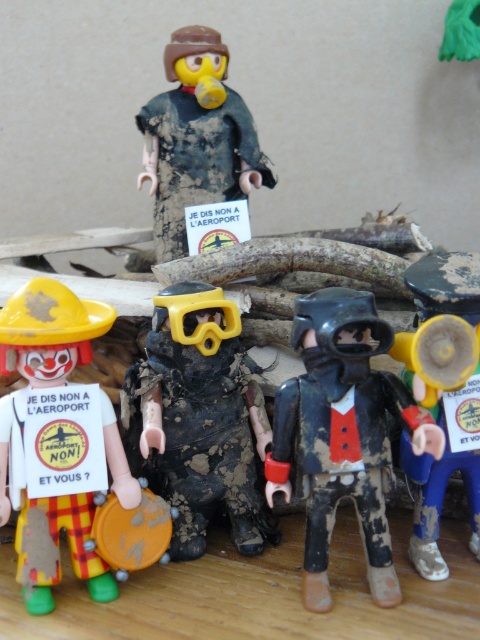
Question: Can you confirm if matte black figure at center is positioned to the left of dirty plastic figure at upper center?

Choices:
 (A) no
 (B) yes

Answer: (A)

Question: Can you confirm if matte yellow hat at left is positioned above yellow matte megaphone at right?

Choices:
 (A) no
 (B) yes

Answer: (A)

Question: Which of these objects is positioned farthest from the dirty plastic figure at upper center?

Choices:
 (A) matte black diving suit at center
 (B) matte yellow hat at left
 (C) matte black figure at center

Answer: (C)

Question: Which point appears farthest from the camera in this image?

Choices:
 (A) (160, 118)
 (B) (66, 362)

Answer: (A)

Question: Is matte yellow hat at left further to the viewer compared to yellow matte megaphone at right?

Choices:
 (A) yes
 (B) no

Answer: (B)

Question: Which point is closer to the camera?

Choices:
 (A) click(x=325, y=308)
 (B) click(x=191, y=33)
 (C) click(x=74, y=548)
 (D) click(x=417, y=356)

Answer: (D)